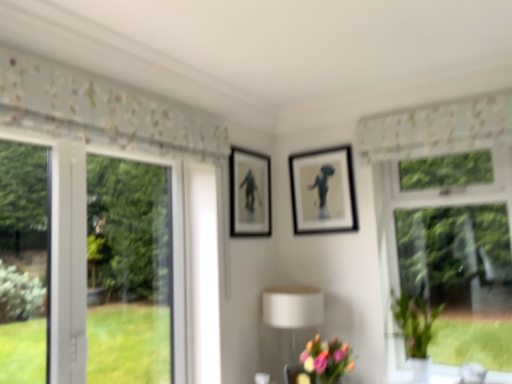
You are a GUI agent. You are given a task and a screenshot of the screen. Output one action in this format:
    pyautogui.click(x=<x>, y=<y>)
    Task: Click on the green glossy vase at right
    
    Given the screenshot: What is the action you would take?
    pyautogui.click(x=414, y=321)

The width and height of the screenshot is (512, 384). What are the coordinates of `matte black picture frame at center, acting as the 2th picture frame starting from the left` in the screenshot? It's located at (323, 191).

Identify the location of black matte picture frame at center, which is counted as the 1th picture frame, starting from the left. The image size is (512, 384). (249, 193).

What do you see at coordinates (249, 193) in the screenshot?
I see `black matte picture frame at center, which is counted as the second picture frame, starting from the right` at bounding box center [249, 193].

Where is `pastel bouquet at lower center`? The image size is (512, 384). pastel bouquet at lower center is located at coordinates (327, 358).

What do you see at coordinates (327, 358) in the screenshot? The image size is (512, 384). I see `pastel bouquet at lower center` at bounding box center [327, 358].

At what (x,y) coordinates should I click in order to perform the action: click on green glossy vase at right. Please return your answer as a coordinate pair (x, y). The image size is (512, 384). Looking at the image, I should click on (414, 321).

Which object is wider, white floral fabric at upper center or pastel bouquet at lower center?

Wider between the two is pastel bouquet at lower center.

Consider the image. Is the depth of white floral fabric at upper center greater than that of pastel bouquet at lower center?

Yes, white floral fabric at upper center is further from the viewer.

From a real-world perspective, between white floral fabric at upper center and pastel bouquet at lower center, who is vertically lower?

pastel bouquet at lower center, from a real-world perspective.

From their relative heights in the image, would you say white floral fabric at upper center is taller or shorter than pastel bouquet at lower center?

Clearly, white floral fabric at upper center is shorter compared to pastel bouquet at lower center.

Which is farther from the camera, (293, 196) or (338, 344)?

Positioned behind is point (293, 196).

Locate an element on the screen. The image size is (512, 384). picture frame on the right of pastel bouquet at lower center is located at coordinates (323, 191).

Considering the sizes of objects matte black picture frame at center, acting as the 2th picture frame starting from the left, and pastel bouquet at lower center in the image provided, who is wider, matte black picture frame at center, acting as the 2th picture frame starting from the left, or pastel bouquet at lower center?

pastel bouquet at lower center.

Is matte black picture frame at center, which is the 1th picture frame from right to left, positioned in front of pastel bouquet at lower center?

No, matte black picture frame at center, which is the 1th picture frame from right to left, is further to the viewer.

From a real-world perspective, is matte black picture frame at center, acting as the 2th picture frame starting from the left, positioned over black matte picture frame at center, which is counted as the second picture frame, starting from the right, based on gravity?

Yes, from a real-world perspective, matte black picture frame at center, acting as the 2th picture frame starting from the left, is on top of black matte picture frame at center, which is counted as the second picture frame, starting from the right.

Does matte black picture frame at center, which is the 1th picture frame from right to left, have a greater width compared to black matte picture frame at center, which is counted as the second picture frame, starting from the right?

Correct, the width of matte black picture frame at center, which is the 1th picture frame from right to left, exceeds that of black matte picture frame at center, which is counted as the second picture frame, starting from the right.

Is matte black picture frame at center, which is the 1th picture frame from right to left, oriented towards black matte picture frame at center, which is counted as the 1th picture frame, starting from the left?

Yes, matte black picture frame at center, which is the 1th picture frame from right to left, is facing black matte picture frame at center, which is counted as the 1th picture frame, starting from the left.

From the image's perspective, relative to green glossy vase at right, is white matte table lamp at lower center above or below?

white matte table lamp at lower center is below green glossy vase at right.

You are a GUI agent. You are given a task and a screenshot of the screen. Output one action in this format:
    pyautogui.click(x=<x>, y=<y>)
    Task: Click on the table lamp on the left side of green glossy vase at right
    
    Given the screenshot: What is the action you would take?
    pyautogui.click(x=293, y=312)

From a real-world perspective, between white matte table lamp at lower center and green glossy vase at right, who is vertically higher?

From a 3D spatial view, green glossy vase at right is above.

Can we say white matte table lamp at lower center lies outside green glossy vase at right?

white matte table lamp at lower center is positioned outside green glossy vase at right.

Would you consider black matte picture frame at center, which is counted as the 1th picture frame, starting from the left, to be distant from green glossy vase at right?

That's right, there is a large distance between black matte picture frame at center, which is counted as the 1th picture frame, starting from the left, and green glossy vase at right.

Relative to green glossy vase at right, is black matte picture frame at center, which is counted as the second picture frame, starting from the right, in front or behind?

black matte picture frame at center, which is counted as the second picture frame, starting from the right, is behind green glossy vase at right.

From the image's perspective, is black matte picture frame at center, which is counted as the 1th picture frame, starting from the left, below green glossy vase at right?

Incorrect, from the image's perspective, black matte picture frame at center, which is counted as the 1th picture frame, starting from the left, is higher than green glossy vase at right.

Which is farther, (234,190) or (423,336)?

The point (234,190) is farther.

Which object is further away from the camera, green glossy vase at right or white matte table lamp at lower center?

white matte table lamp at lower center is behind.

Consider the image. Considering the positions of objects green glossy vase at right and white matte table lamp at lower center in the image provided, who is more to the left, green glossy vase at right or white matte table lamp at lower center?

white matte table lamp at lower center.

Would you say green glossy vase at right is a long distance from white matte table lamp at lower center?

Actually, green glossy vase at right and white matte table lamp at lower center are a little close together.

Find the location of a particular element. curtain above the black matte picture frame at center, which is counted as the second picture frame, starting from the right (from the image's perspective) is located at coordinates (437, 128).

Are black matte picture frame at center, which is counted as the 1th picture frame, starting from the left, and white floral fabric at upper center beside each other?

No, black matte picture frame at center, which is counted as the 1th picture frame, starting from the left, is not in contact with white floral fabric at upper center.

Considering the relative sizes of black matte picture frame at center, which is counted as the 1th picture frame, starting from the left, and white floral fabric at upper center in the image provided, is black matte picture frame at center, which is counted as the 1th picture frame, starting from the left, smaller than white floral fabric at upper center?

Yes.

Does black matte picture frame at center, which is counted as the second picture frame, starting from the right, come in front of white floral fabric at upper center?

No, black matte picture frame at center, which is counted as the second picture frame, starting from the right, is further to the viewer.

Find the location of a particular element. The height and width of the screenshot is (384, 512). curtain on the right of pastel bouquet at lower center is located at coordinates (437, 128).

Where is `flower on the left of the matte black picture frame at center, which is the 1th picture frame from right to left`? This screenshot has height=384, width=512. flower on the left of the matte black picture frame at center, which is the 1th picture frame from right to left is located at coordinates (327, 358).

From the image, which object appears to be farther from white matte table lamp at lower center, pastel bouquet at lower center or black matte picture frame at center, which is counted as the 1th picture frame, starting from the left?

The object further to white matte table lamp at lower center is black matte picture frame at center, which is counted as the 1th picture frame, starting from the left.

Estimate the real-world distances between objects in this image. Which object is further from white floral fabric at upper center, pastel bouquet at lower center or matte black picture frame at center, which is the 1th picture frame from right to left?

Based on the image, pastel bouquet at lower center appears to be further to white floral fabric at upper center.

When comparing their distances from pastel bouquet at lower center, does green glossy vase at right or white matte table lamp at lower center seem further?

The object further to pastel bouquet at lower center is green glossy vase at right.

Considering their positions, is black matte picture frame at center, which is counted as the 1th picture frame, starting from the left, positioned closer to matte black picture frame at center, which is the 1th picture frame from right to left, than pastel bouquet at lower center?

black matte picture frame at center, which is counted as the 1th picture frame, starting from the left, is closer to matte black picture frame at center, which is the 1th picture frame from right to left.

Looking at the image, which one is located further to white floral fabric at upper center, green glossy vase at right or white matte table lamp at lower center?

white matte table lamp at lower center.

Looking at the image, which one is located further to green glossy vase at right, matte black picture frame at center, which is the 1th picture frame from right to left, or black matte picture frame at center, which is counted as the second picture frame, starting from the right?

Among the two, black matte picture frame at center, which is counted as the second picture frame, starting from the right, is located further to green glossy vase at right.

Estimate the real-world distances between objects in this image. Which object is closer to green glossy vase at right, white matte table lamp at lower center or black matte picture frame at center, which is counted as the second picture frame, starting from the right?

Based on the image, white matte table lamp at lower center appears to be nearer to green glossy vase at right.

Based on their spatial positions, is black matte picture frame at center, which is counted as the second picture frame, starting from the right, or green glossy vase at right closer to matte black picture frame at center, acting as the 2th picture frame starting from the left?

black matte picture frame at center, which is counted as the second picture frame, starting from the right, is closer to matte black picture frame at center, acting as the 2th picture frame starting from the left.

This screenshot has width=512, height=384. What are the coordinates of `table lamp between matte black picture frame at center, which is the 1th picture frame from right to left, and pastel bouquet at lower center, in the vertical direction` in the screenshot? It's located at (293, 312).

Image resolution: width=512 pixels, height=384 pixels. I want to click on picture frame between matte black picture frame at center, acting as the 2th picture frame starting from the left, and white matte table lamp at lower center from top to bottom, so click(249, 193).

Where is `plant between white floral fabric at upper center and pastel bouquet at lower center vertically`? The image size is (512, 384). plant between white floral fabric at upper center and pastel bouquet at lower center vertically is located at coordinates (414, 321).

You are a GUI agent. You are given a task and a screenshot of the screen. Output one action in this format:
    pyautogui.click(x=<x>, y=<y>)
    Task: Click on the table lamp between black matte picture frame at center, which is counted as the second picture frame, starting from the right, and pastel bouquet at lower center from top to bottom
    The image size is (512, 384).
    Given the screenshot: What is the action you would take?
    pyautogui.click(x=293, y=312)